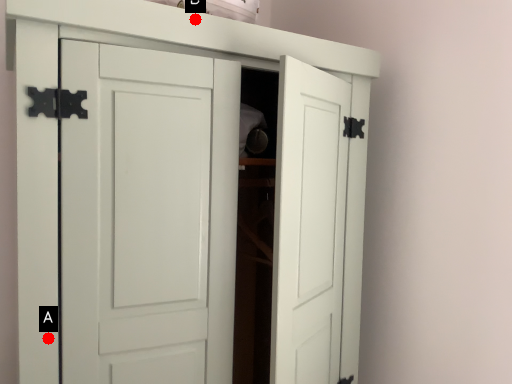
Question: Two points are circled on the image, labeled by A and B beside each circle. Among these points, which one is farthest from the camera?

Choices:
 (A) A is further
 (B) B is further

Answer: (B)